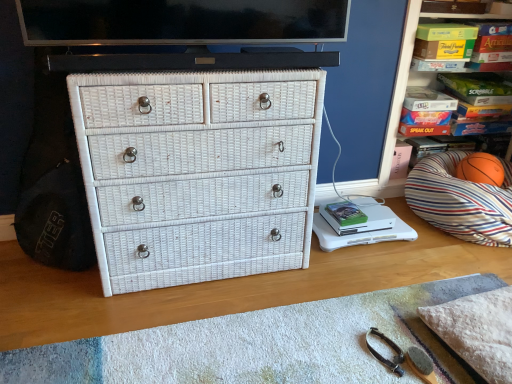
Where is `matte cardboard boxes at upper right`? matte cardboard boxes at upper right is located at coordinates point(404,93).

What is the approximate height of matte cardboard boxes at upper right?

matte cardboard boxes at upper right is 3.54 feet tall.

Where is `white textured pillow at lower right`? This screenshot has width=512, height=384. white textured pillow at lower right is located at coordinates (477, 331).

Describe the element at coordinates (461, 200) in the screenshot. I see `striped fabric pillow at right` at that location.

Image resolution: width=512 pixels, height=384 pixels. What are the coordinates of `white wicker drawer at center` in the screenshot? It's located at (258, 344).

You are a GUI agent. You are given a task and a screenshot of the screen. Output one action in this format:
    pyautogui.click(x=<x>, y=<y>)
    Task: Click on the flat screen tv at upper center
    This screenshot has height=384, width=512.
    Given the screenshot: What is the action you would take?
    pyautogui.click(x=181, y=21)

The height and width of the screenshot is (384, 512). In order to click on white wicker chest of drawers at center in this screenshot , I will do `click(198, 173)`.

You are a GUI agent. You are given a task and a screenshot of the screen. Output one action in this format:
    pyautogui.click(x=<x>, y=<y>)
    Task: Click on the matte cardboard boxes at upper right
    The height and width of the screenshot is (384, 512).
    Given the screenshot: What is the action you would take?
    pyautogui.click(x=404, y=93)

Between striped fabric pillow at right and orange rubber basketball at right, which one has smaller width?

Thinner between the two is orange rubber basketball at right.

Based on the photo, how much distance is there between striped fabric pillow at right and orange rubber basketball at right?

The distance of striped fabric pillow at right from orange rubber basketball at right is 6.37 inches.

From the picture: Is striped fabric pillow at right at the left side of orange rubber basketball at right?

Yes.

Considering the sizes of objects striped fabric pillow at right and orange rubber basketball at right in the image provided, who is shorter, striped fabric pillow at right or orange rubber basketball at right?

orange rubber basketball at right.

Considering the relative positions of green matte book at center and white plastic changing table at lower right in the image provided, is green matte book at center to the left or to the right of white plastic changing table at lower right?

Based on their positions, green matte book at center is located to the left of white plastic changing table at lower right.

In order to click on changing table on the right of green matte book at center in this screenshot , I will do `click(358, 224)`.

Is green matte book at center turned away from white plastic changing table at lower right?

No, green matte book at center's orientation is not away from white plastic changing table at lower right.

Consider the image. From the image's perspective, is green matte book at center located beneath white plastic changing table at lower right?

No, from the image's perspective, green matte book at center is not beneath white plastic changing table at lower right.

Between orange rubber basketball at right and white wicker chest of drawers at center, which one has larger size?

white wicker chest of drawers at center.

In the scene shown: From the image's perspective, is orange rubber basketball at right above or below white wicker chest of drawers at center?

Clearly, from the image's perspective, orange rubber basketball at right is above white wicker chest of drawers at center.

The image size is (512, 384). I want to click on basketball lying above the white wicker chest of drawers at center (from the image's perspective), so pos(481,169).

Measure the distance between orange rubber basketball at right and white wicker chest of drawers at center.

orange rubber basketball at right is 1.36 meters from white wicker chest of drawers at center.

Are white wicker chest of drawers at center and white plastic changing table at lower right making contact?

white wicker chest of drawers at center is not next to white plastic changing table at lower right, and they're not touching.

From the picture: Which object is thinner, white wicker chest of drawers at center or white plastic changing table at lower right?

white plastic changing table at lower right is thinner.

Is point (234, 151) positioned before point (319, 209)?

That is True.

Is white wicker chest of drawers at center oriented towards white plastic changing table at lower right?

No.

Looking at this image, from the image's perspective, who appears lower, orange rubber basketball at right or white wicker drawer at center?

From the image's view, white wicker drawer at center is below.

I want to click on basketball behind the white wicker drawer at center, so click(481, 169).

From a real-world perspective, between orange rubber basketball at right and white wicker drawer at center, who is vertically lower?

white wicker drawer at center, from a real-world perspective.

From a real-world perspective, is matte cardboard boxes at upper right positioned above or below white wicker drawer at center?

In terms of real-world spatial position, matte cardboard boxes at upper right is above white wicker drawer at center.

Is matte cardboard boxes at upper right not close to white wicker drawer at center?

Yes.

Does matte cardboard boxes at upper right turn towards white wicker drawer at center?

No, matte cardboard boxes at upper right does not turn towards white wicker drawer at center.

Measure the distance between matte cardboard boxes at upper right and white wicker drawer at center.

matte cardboard boxes at upper right is 1.25 meters away from white wicker drawer at center.

The width and height of the screenshot is (512, 384). I want to click on television that appears above the white textured pillow at lower right (from the image's perspective), so click(181, 21).

In the image, is flat screen tv at upper center on the left side or the right side of white textured pillow at lower right?

From the image, it's evident that flat screen tv at upper center is to the left of white textured pillow at lower right.

Based on the photo, which is nearer, (139, 35) or (470, 353)?

Point (139, 35) appears to be farther away from the viewer than point (470, 353).

Locate an element on the screen. The width and height of the screenshot is (512, 384). basketball located above the striped fabric pillow at right (from a real-world perspective) is located at coordinates (481, 169).

What are the coordinates of `changing table on the right of green matte book at center` in the screenshot? It's located at (358, 224).

Estimate the real-world distances between objects in this image. Which object is further from flat screen tv at upper center, matte cardboard boxes at upper right or orange rubber basketball at right?

orange rubber basketball at right lies further to flat screen tv at upper center than the other object.

Looking at this image, based on their spatial positions, is white textured pillow at lower right or matte cardboard boxes at upper right closer to white wicker chest of drawers at center?

Among the two, white textured pillow at lower right is located nearer to white wicker chest of drawers at center.

Based on their spatial positions, is green matte book at center or white wicker chest of drawers at center further from striped fabric pillow at right?

white wicker chest of drawers at center is further to striped fabric pillow at right.

When comparing their distances from matte cardboard boxes at upper right, does green matte book at center or flat screen tv at upper center seem further?

flat screen tv at upper center is positioned further to the anchor matte cardboard boxes at upper right.

Looking at the image, which one is located further to flat screen tv at upper center, green matte book at center or white textured pillow at lower right?

white textured pillow at lower right lies further to flat screen tv at upper center than the other object.

Looking at this image, which object lies nearer to the anchor point white wicker chest of drawers at center, green matte book at center or white wicker drawer at center?

Among the two, white wicker drawer at center is located nearer to white wicker chest of drawers at center.

Which object lies nearer to the anchor point white plastic changing table at lower right, striped fabric pillow at right or white wicker drawer at center?

striped fabric pillow at right.

Estimate the real-world distances between objects in this image. Which object is further from striped fabric pillow at right, white wicker drawer at center or orange rubber basketball at right?

white wicker drawer at center.

Find the location of a particular element. This screenshot has width=512, height=384. shelf located between white wicker drawer at center and striped fabric pillow at right in the left-right direction is located at coordinates (404, 93).

You are a GUI agent. You are given a task and a screenshot of the screen. Output one action in this format:
    pyautogui.click(x=<x>, y=<y>)
    Task: Click on the plain between white wicker chest of drawers at center and matte cardboard boxes at upper right from left to right
    The height and width of the screenshot is (384, 512).
    Given the screenshot: What is the action you would take?
    pyautogui.click(x=258, y=344)

Locate an element on the screen. chest of drawers between flat screen tv at upper center and white wicker drawer at center from top to bottom is located at coordinates (198, 173).

Where is `shelf between white wicker chest of drawers at center and orange rubber basketball at right in the horizontal direction`? This screenshot has width=512, height=384. shelf between white wicker chest of drawers at center and orange rubber basketball at right in the horizontal direction is located at coordinates (404, 93).